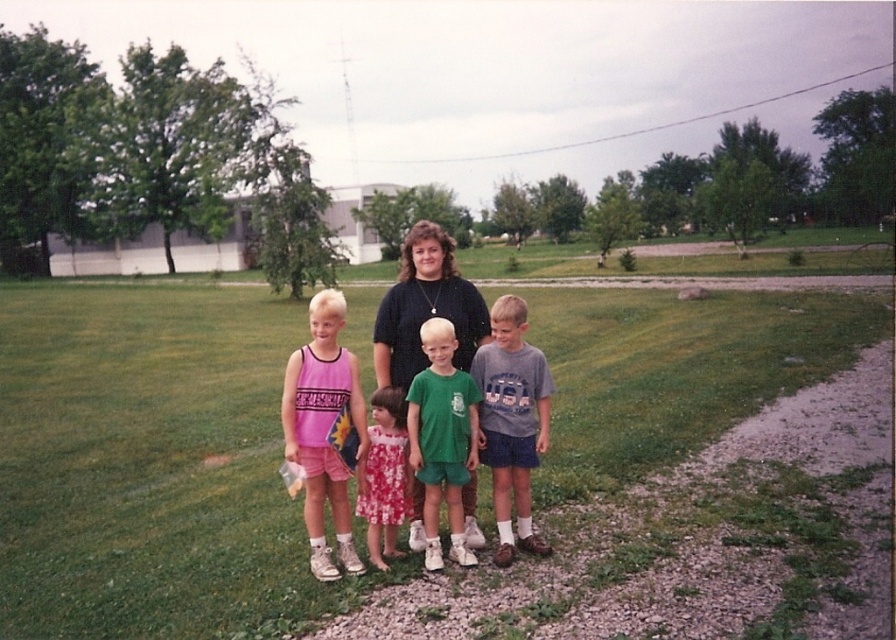
Between green grass at center and pink jersey at left, which one appears on the left side from the viewer's perspective?

green grass at center is more to the left.

In order to click on green grass at center in this screenshot , I will do `click(149, 465)`.

Does green matte shirt at center have a lesser height compared to matte black shirt at center?

Indeed, green matte shirt at center has a lesser height compared to matte black shirt at center.

What are the coordinates of `green matte shirt at center` in the screenshot? It's located at (442, 440).

Is gray cotton t-shirt at center smaller than floral cotton dress at center?

Incorrect, gray cotton t-shirt at center is not smaller in size than floral cotton dress at center.

Is gray cotton t-shirt at center thinner than floral cotton dress at center?

A: No.

Find the location of a particular element. gray cotton t-shirt at center is located at coordinates (513, 420).